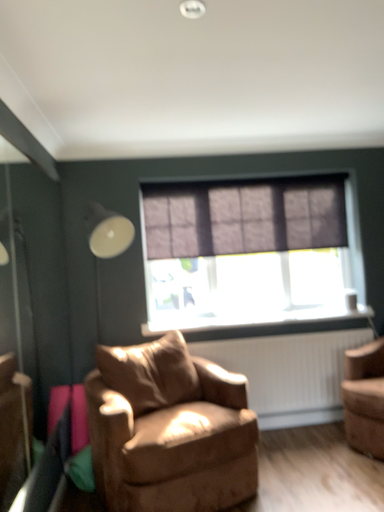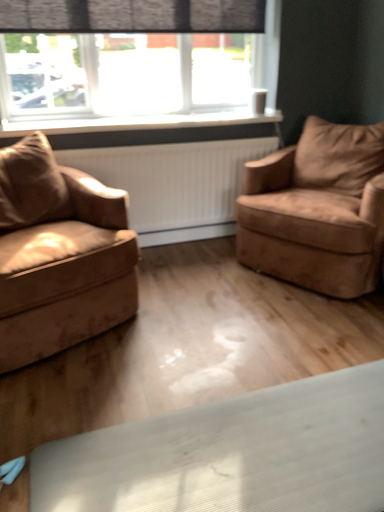
Question: Which way did the camera rotate in the video?

Choices:
 (A) rotated downward
 (B) rotated upward

Answer: (A)